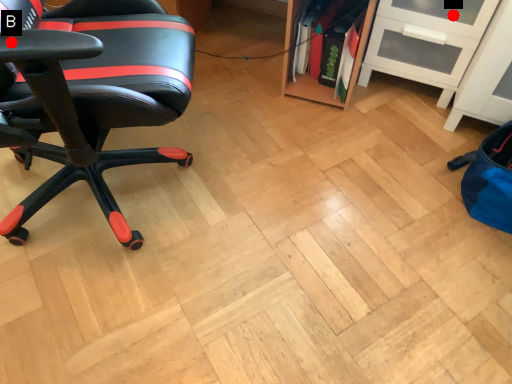
Question: Two points are circled on the image, labeled by A and B beside each circle. Which point appears closest to the camera in this image?

Choices:
 (A) A is closer
 (B) B is closer

Answer: (B)